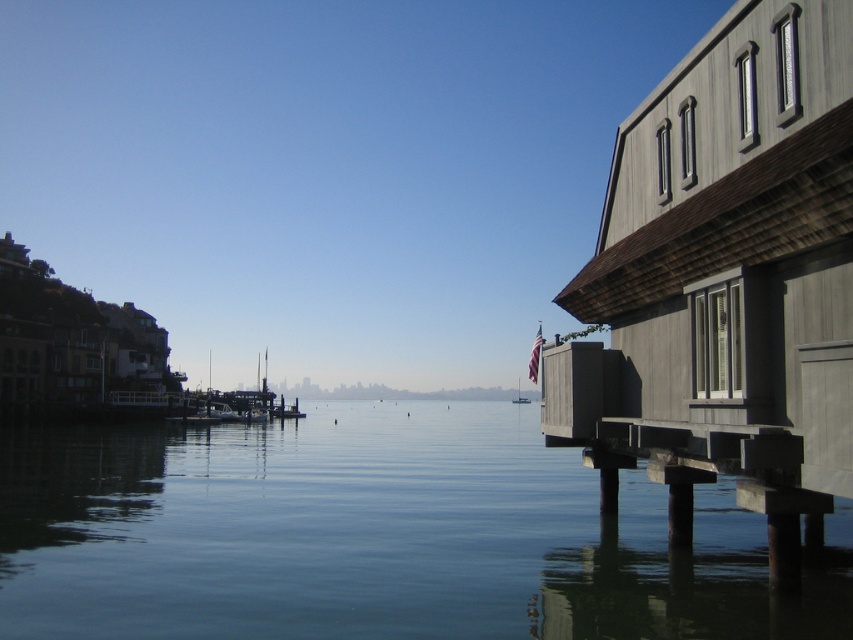
You are standing at the point with coordinates (375, 536) in the image. What can you see directly below you?

At point (375, 536) lies clear water at center.

You are standing on the pier and want to place a new boat between the clear water at center and the white plastic boat at center. Can you fit the new boat there if it requires 100 meters of space?

The clear water at center and white plastic boat at center are 227.72 meters apart from each other, so yes, the new boat can fit between them since there is enough space.

You are standing on the pier and see the clear water at center and the white plastic boat at center. Which object is directly above the other?

The clear water at center is positioned over the white plastic boat at center, meaning the water is above the boat.